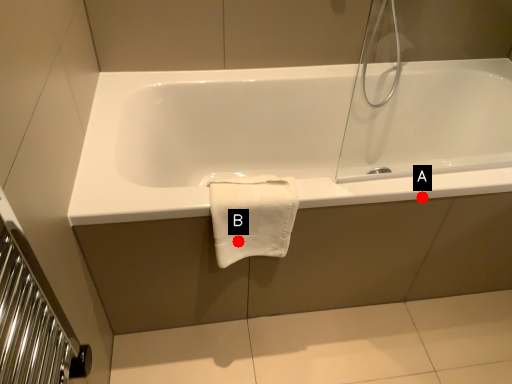
Question: Two points are circled on the image, labeled by A and B beside each circle. Among these points, which one is nearest to the camera?

Choices:
 (A) A is closer
 (B) B is closer

Answer: (B)